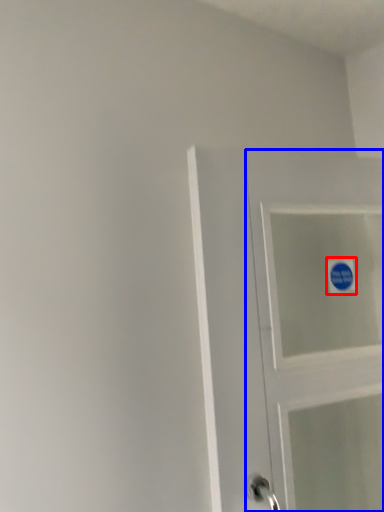
Question: Which of the following is the closest to the observer, sticker (highlighted by a red box) or door (highlighted by a blue box)?

Choices:
 (A) sticker
 (B) door

Answer: (B)